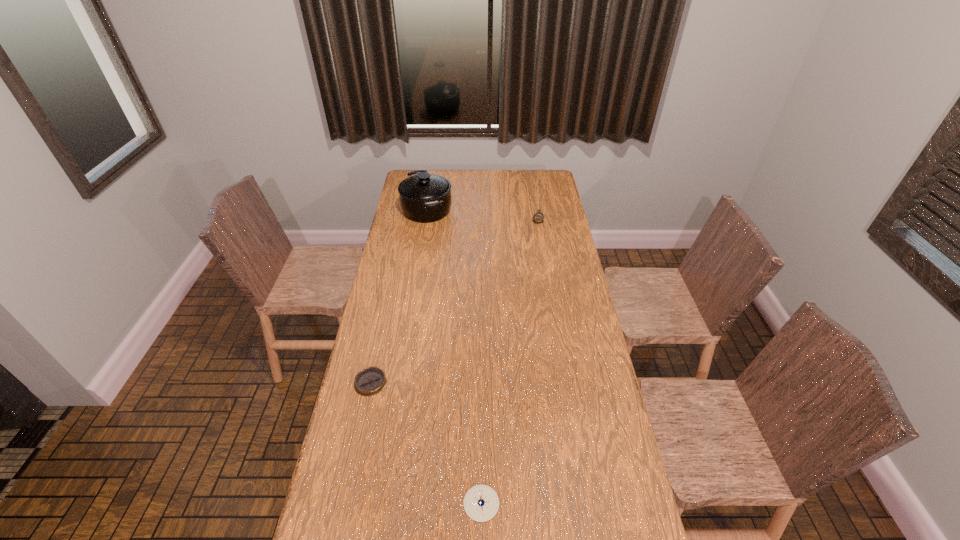
At what (x,y) coordinates should I click in order to perform the action: click on free location located 0.380m on the right of the third farthest object. Please return your answer as a coordinate pair (x, y). Image resolution: width=960 pixels, height=540 pixels. Looking at the image, I should click on (499, 383).

This screenshot has width=960, height=540. In order to click on saucepan at the left edge in this screenshot , I will do `click(424, 198)`.

Locate an element on the screen. compass at the left edge is located at coordinates (370, 381).

This screenshot has width=960, height=540. Identify the location of object present at the right edge. (538, 217).

This screenshot has width=960, height=540. In order to click on vacant space at the far edge in this screenshot , I will do `click(462, 188)`.

Image resolution: width=960 pixels, height=540 pixels. I want to click on vacant space at the left edge of the desktop, so click(374, 453).

The image size is (960, 540). In the image, there is a desktop. Identify the location of vacant space at the right edge. (553, 267).

The height and width of the screenshot is (540, 960). In the image, there is a desktop. Find the location of `free region at the far right corner`. free region at the far right corner is located at coordinates (545, 188).

The image size is (960, 540). I want to click on unoccupied area between the rightmost object and the second shortest compass, so click(510, 361).

Find the location of a particular element. This screenshot has height=540, width=960. vacant area that lies between the leftmost compass and the rightmost object is located at coordinates (454, 301).